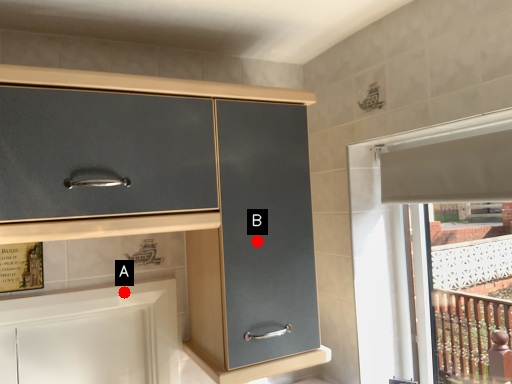
Question: Two points are circled on the image, labeled by A and B beside each circle. Which point is closer to the camera?

Choices:
 (A) A is closer
 (B) B is closer

Answer: (B)